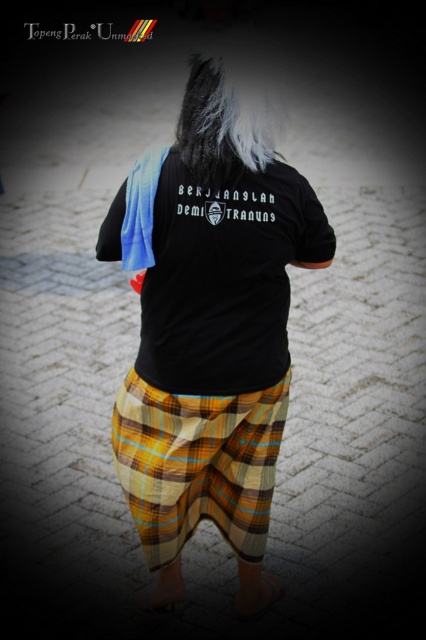
You are standing at point (207, 84) and want to walk to the person in the image. Which direction should you move relative to point (195, 465)?

You should move towards point (195, 465) because it is behind point (207, 84), meaning the person is in that direction.